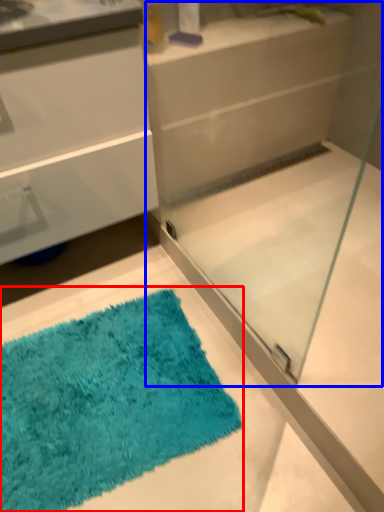
Question: Which of the following is the closest to the observer, bath mat (highlighted by a red box) or glass box (highlighted by a blue box)?

Choices:
 (A) bath mat
 (B) glass box

Answer: (B)